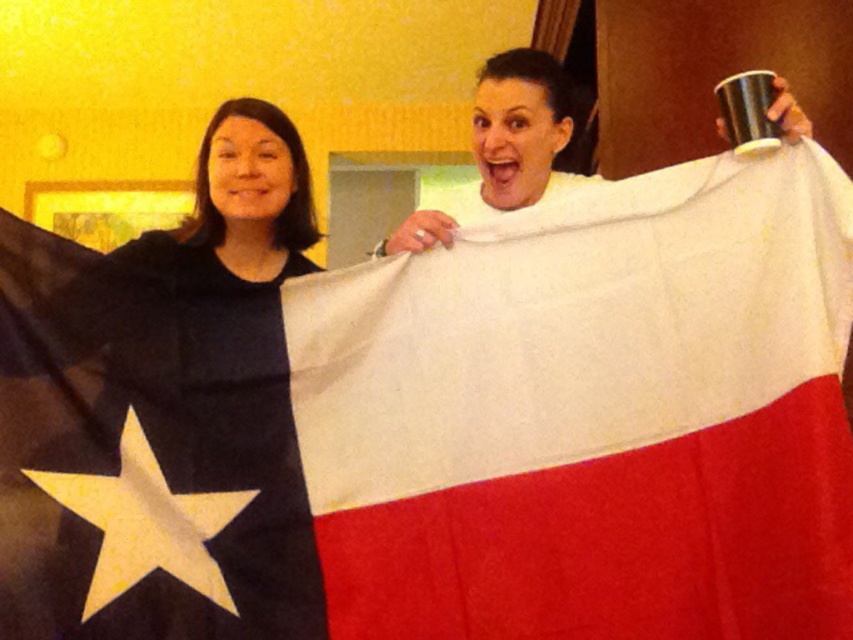
You are a photographer trying to capture the matte black shirt at left in the image. If the camera is positioned at the origin point, which is the bottom left corner of the image, can you estimate the shirt is located in the upper half or lower half of the image?

The position of matte black shirt at left is at point (248,196). Since the y coordinate is 0.293, which is less than 0.5, the shirt is located in the lower half of the image.

You are an event planner setting up a booth for a Texas pride event. You need to place a Texas flag between two objects, the matte black shirt at left and the white matte cup at upper center. Based on their positions, which object should the flag be closer to?

The flag should be closer to the matte black shirt at left because the matte black shirt at left is positioned to the left of the white matte cup at upper center, so the flag would naturally be placed between them with the shirt on the left side.

You are a photographer setting up for a group photo. You notice the matte black shirt at left and the white matte cup at upper center. Which object is closer to the camera based on their heights in the image?

The matte black shirt at left is shorter than the white matte cup at upper center, so the cup is taller in the image. Since objects closer to the camera appear larger, the white matte cup at upper center must be closer to the camera than the matte black shirt at left.